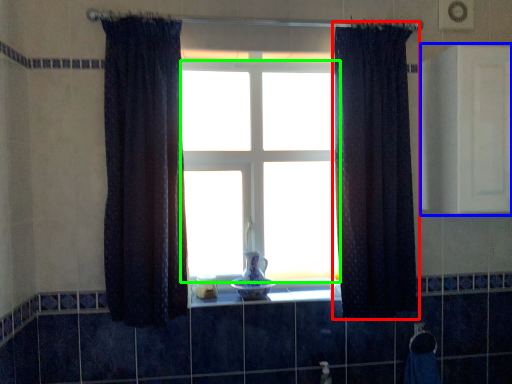
Question: Which is farther away from curtain (highlighted by a red box)? medicine cabinet (highlighted by a blue box) or bay window (highlighted by a green box)?

Choices:
 (A) medicine cabinet
 (B) bay window

Answer: (B)